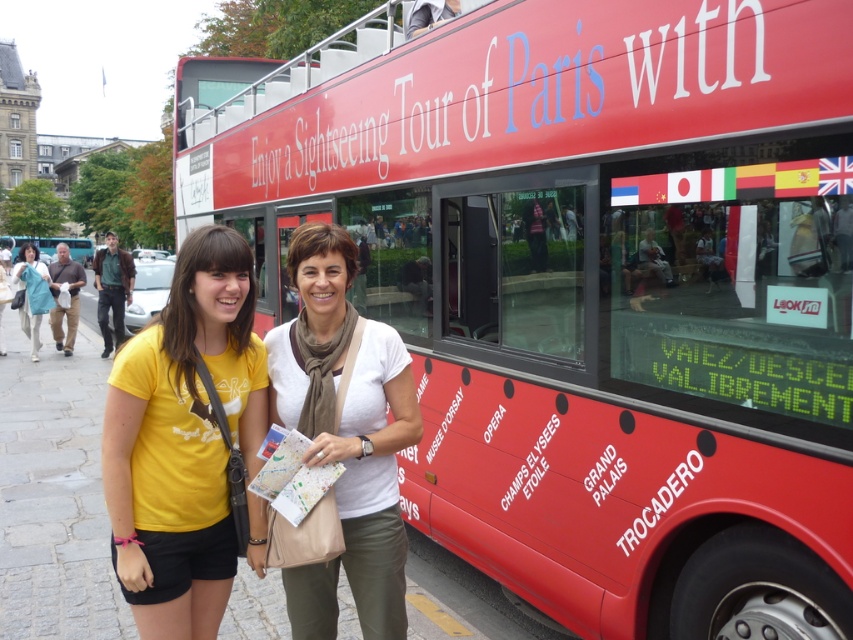
Is white matte scarf at center closer to camera compared to yellow t-shirt at center?

Yes.

Is point (402, 627) closer to viewer compared to point (0, 323)?

Yes, point (402, 627) is in front of point (0, 323).

Locate an element on the screen. This screenshot has width=853, height=640. white matte scarf at center is located at coordinates (344, 436).

Does light blue fabric coat at left have a larger size compared to yellow t-shirt at center?

Correct, light blue fabric coat at left is larger in size than yellow t-shirt at center.

Does light blue fabric coat at left appear on the right side of yellow t-shirt at center?

Incorrect, light blue fabric coat at left is not on the right side of yellow t-shirt at center.

This screenshot has width=853, height=640. Find the location of `light blue fabric coat at left`. light blue fabric coat at left is located at coordinates (32, 292).

This screenshot has height=640, width=853. I want to click on light blue fabric coat at left, so click(32, 292).

Which is below, light blue fabric coat at left or red matte bus at center?

light blue fabric coat at left is lower down.

Find the location of a particular element. The width and height of the screenshot is (853, 640). light blue fabric coat at left is located at coordinates (32, 292).

Between point (15, 269) and point (55, 243), which one is positioned in front?

Point (15, 269) is more forward.

I want to click on light blue fabric coat at left, so click(x=32, y=292).